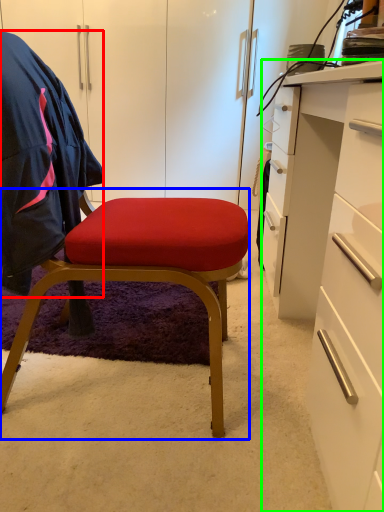
Question: Which object is positioned closest to clothing (highlighted by a red box)? Select from chair (highlighted by a blue box) and desk (highlighted by a green box).

Choices:
 (A) chair
 (B) desk

Answer: (A)